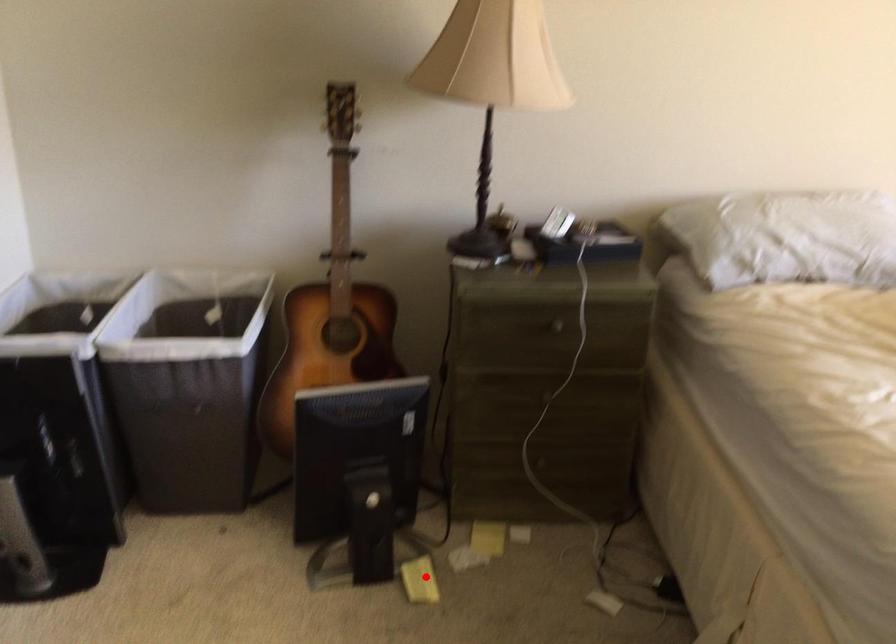
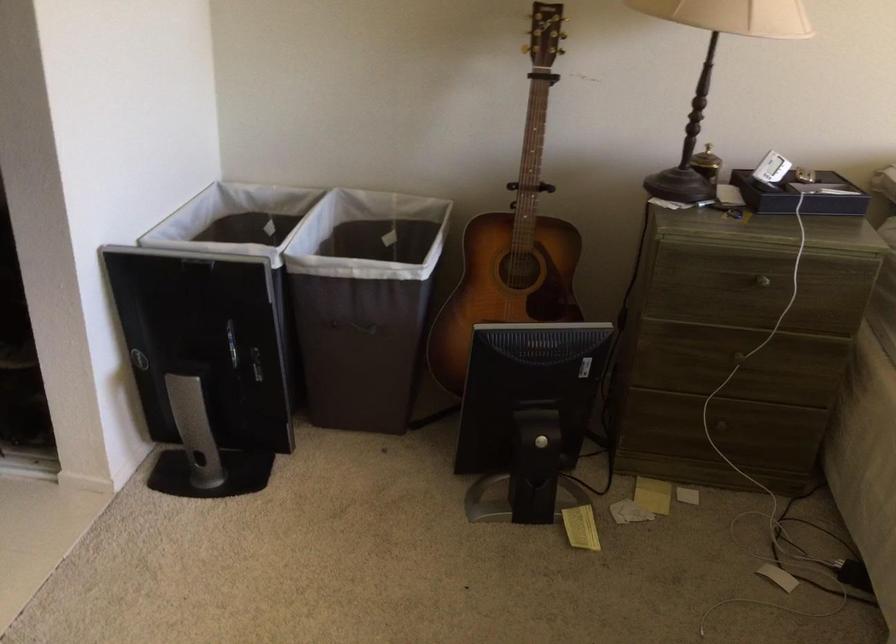
Locate, in the second image, the point that corresponds to the highlighted location in the first image.

(581, 527)